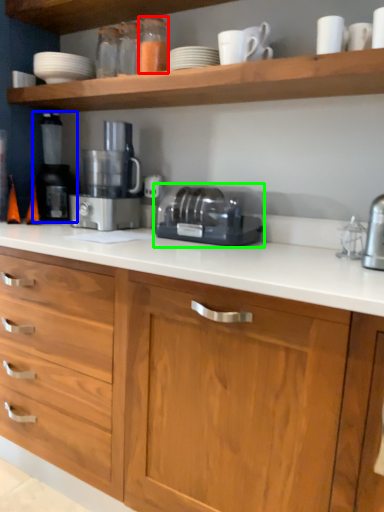
Question: Based on their relative distances, which object is farther from bottle (highlighted by a red box)? Choose from coffee machine (highlighted by a blue box) and toaster (highlighted by a green box).

Choices:
 (A) coffee machine
 (B) toaster

Answer: (A)